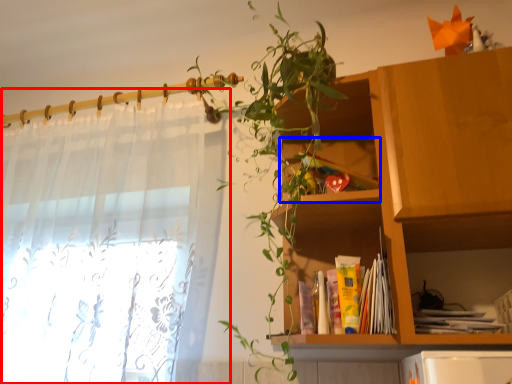
Question: Which object appears closest to the camera in this image, curtain (highlighted by a red box) or cabinet (highlighted by a blue box)?

Choices:
 (A) curtain
 (B) cabinet

Answer: (A)